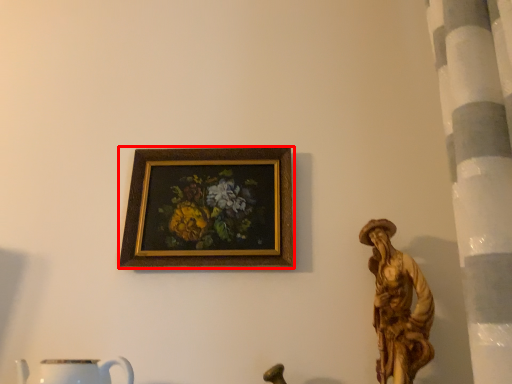
Question: From the image's perspective, considering the relative positions of picture frame (annotated by the red box) and mug in the image provided, where is picture frame (annotated by the red box) located with respect to the staircase?

Choices:
 (A) below
 (B) above

Answer: (B)